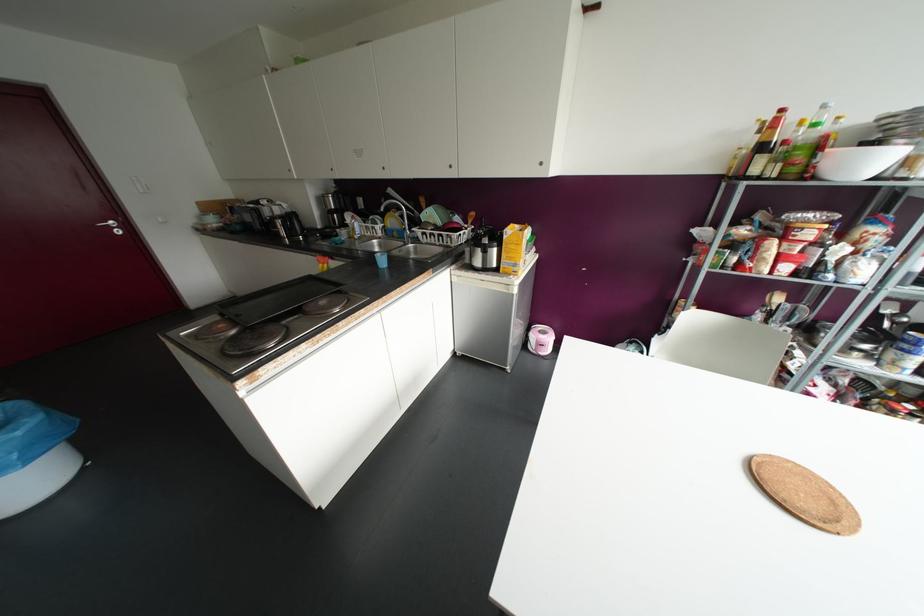
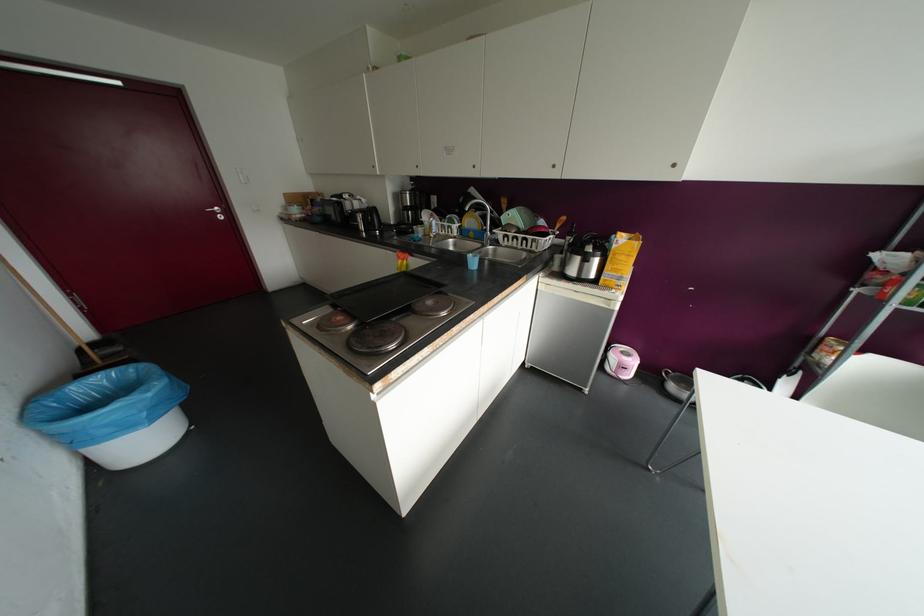
Question: In a continuous first-person perspective shot, in which direction is the camera moving?

Choices:
 (A) Left
 (B) Right
 (C) Forward
 (D) Backward

Answer: (A)